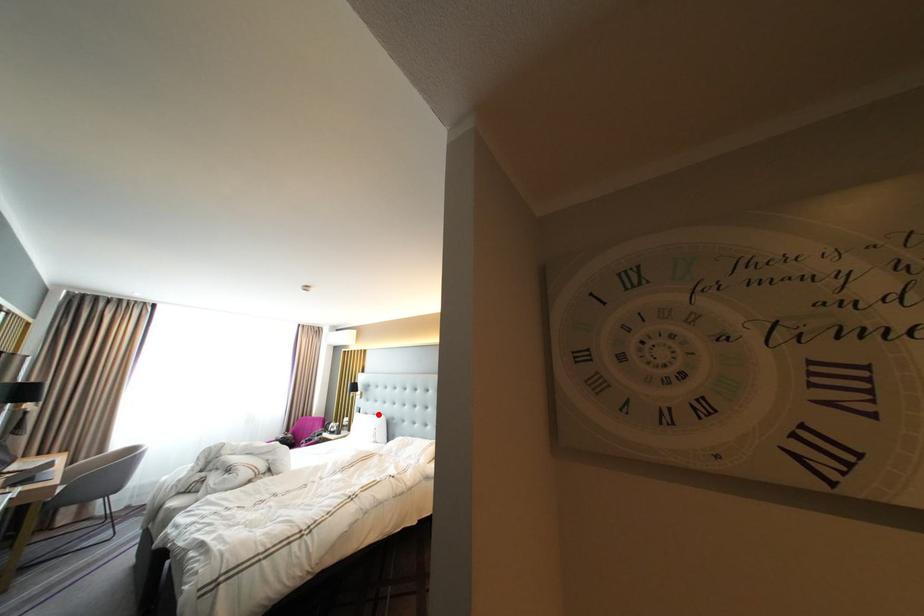
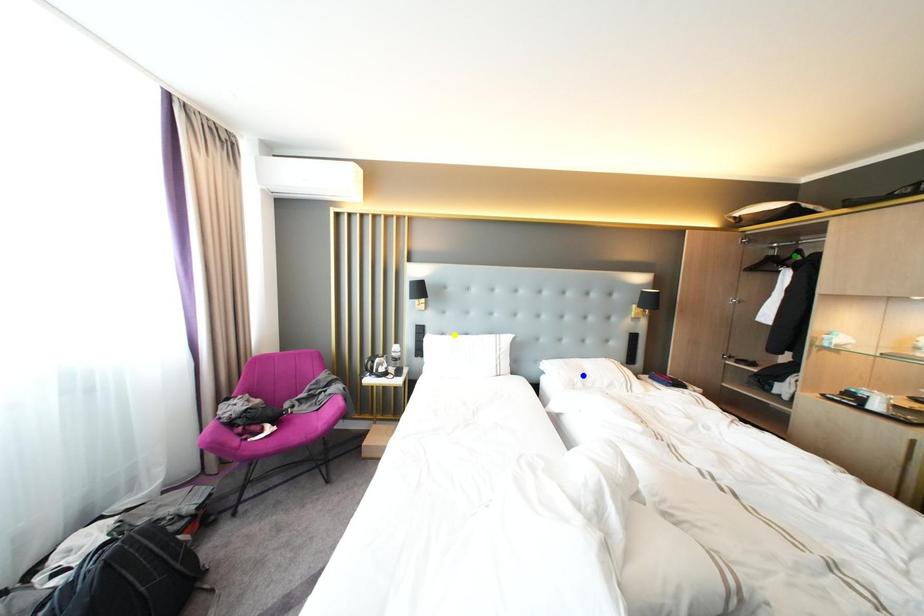
Question: I am providing you with two images of the same scene from different viewpoints. A red point is marked on the first image. You are given multiple points on the second image. Can you choose the point in image 2 that corresponds to the point in image 1?

Choices:
 (A) blue point
 (B) yellow point
 (C) green point

Answer: (B)